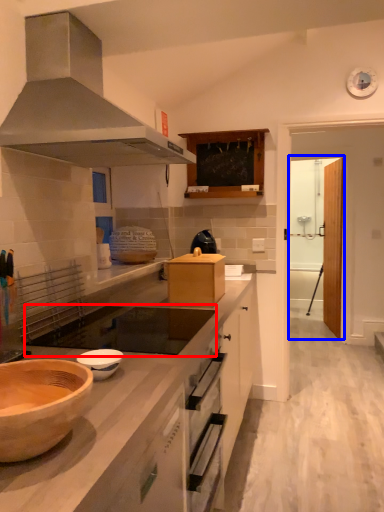
Question: Which object appears farthest to the camera in this image, gas stove (highlighted by a red box) or glass door (highlighted by a blue box)?

Choices:
 (A) gas stove
 (B) glass door

Answer: (B)